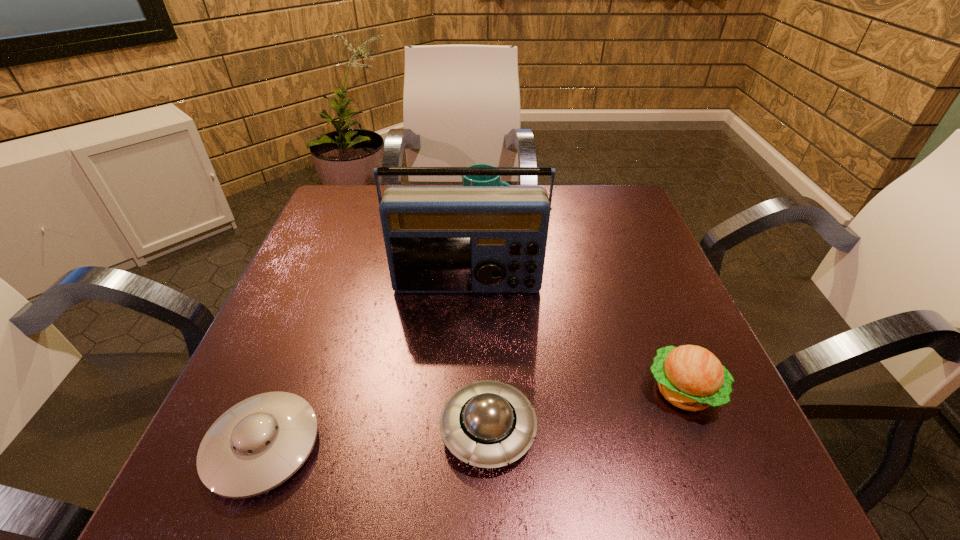
Find the location of `the tallest object`. the tallest object is located at coordinates (439, 239).

Locate an element on the screen. radio receiver is located at coordinates (439, 239).

Identify the location of the farthest object. The width and height of the screenshot is (960, 540). (466, 180).

Locate an element on the screen. This screenshot has height=540, width=960. cup is located at coordinates (466, 180).

Where is `the third shortest object`? the third shortest object is located at coordinates (690, 377).

Find the location of a particular element. This screenshot has width=960, height=540. hamburger is located at coordinates (690, 377).

Find the location of a particular element. This screenshot has height=540, width=960. the fourth tallest object is located at coordinates (488, 423).

Identify the location of the right saucer. (488, 423).

Locate an element on the screen. This screenshot has width=960, height=540. the leftmost object is located at coordinates (259, 443).

The width and height of the screenshot is (960, 540). In order to click on the shorter saucer in this screenshot , I will do `click(259, 443)`.